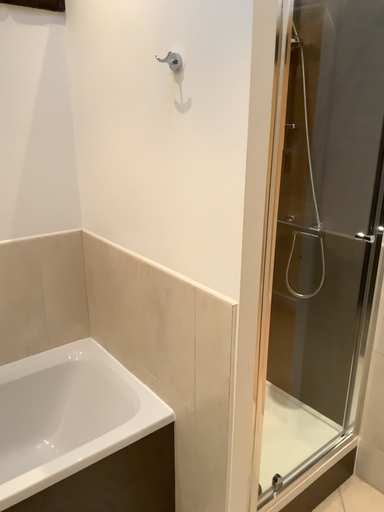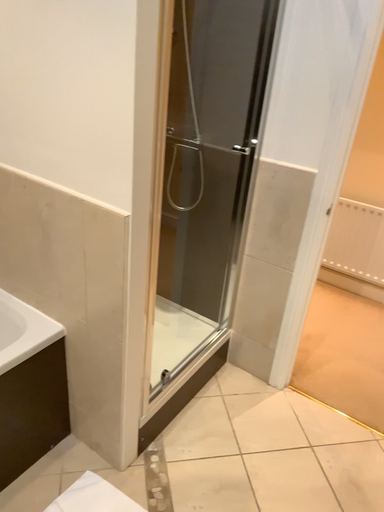
Question: How did the camera likely rotate when shooting the video?

Choices:
 (A) rotated downward
 (B) rotated upward

Answer: (A)